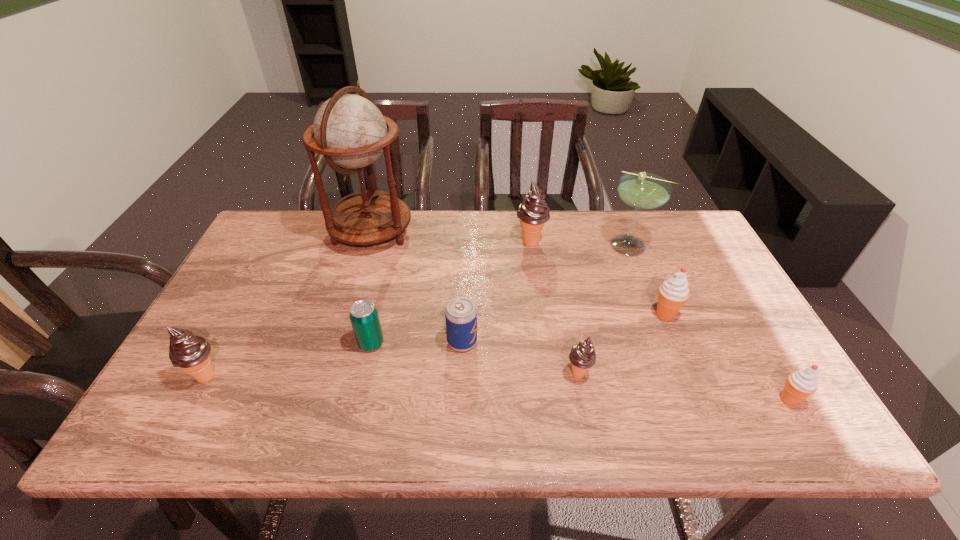
The width and height of the screenshot is (960, 540). I want to click on free region located 0.320m on the back of the right red icecream, so click(726, 290).

You are a GUI agent. You are given a task and a screenshot of the screen. Output one action in this format:
    pyautogui.click(x=<x>, y=<y>)
    Task: Click on the vacant space located on the front of the smallest chocolate icecream
    The image size is (960, 540).
    Given the screenshot: What is the action you would take?
    pyautogui.click(x=588, y=421)

Where is `globe that is at the far edge`? The width and height of the screenshot is (960, 540). globe that is at the far edge is located at coordinates (350, 131).

In order to click on martini that is at the far edge in this screenshot , I will do `click(641, 190)`.

Identify the location of icecream that is at the far edge. The image size is (960, 540). (533, 212).

Where is `object located at the near edge`? This screenshot has width=960, height=540. object located at the near edge is located at coordinates (801, 384).

Where is `object situated at the left edge`? The image size is (960, 540). object situated at the left edge is located at coordinates (190, 353).

Identify the location of martini positioned at the right edge. (641, 190).

Image resolution: width=960 pixels, height=540 pixels. I want to click on icecream located at the right edge, so click(x=801, y=384).

You are a GUI agent. You are given a task and a screenshot of the screen. Output one action in this format:
    pyautogui.click(x=<x>, y=<y>)
    Task: Click on the object present at the far right corner
    The image size is (960, 540).
    Given the screenshot: What is the action you would take?
    pyautogui.click(x=641, y=190)